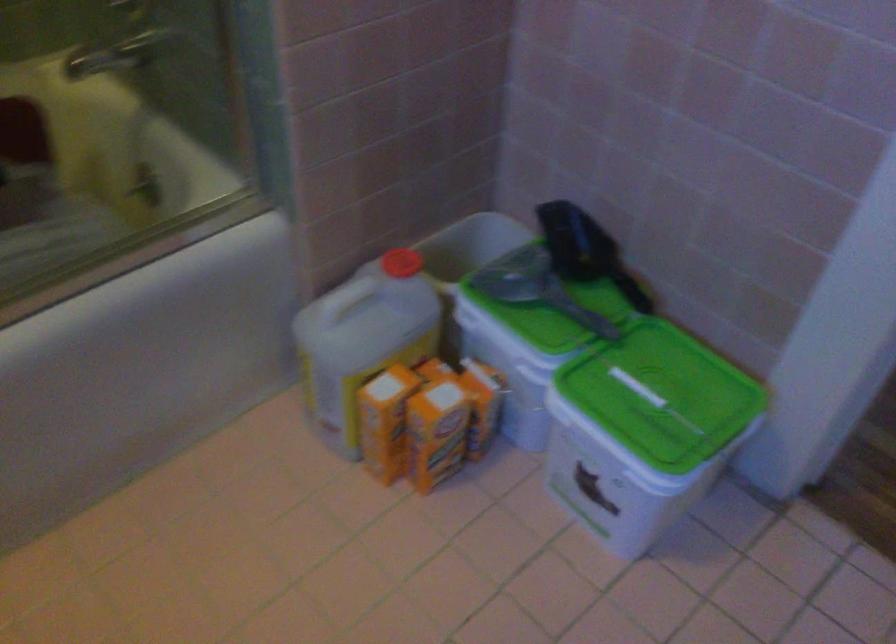
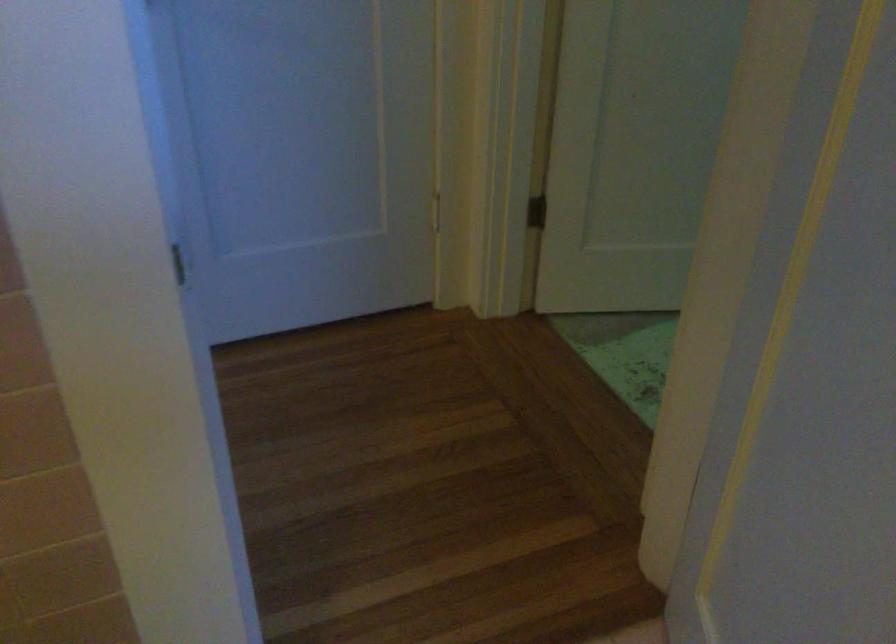
Question: The camera is either moving clockwise (left) or counter-clockwise (right) around the object. The first image is from the beginning of the video and the second image is from the end. Is the camera moving left or right when shooting the video?

Choices:
 (A) Left
 (B) Right

Answer: (A)